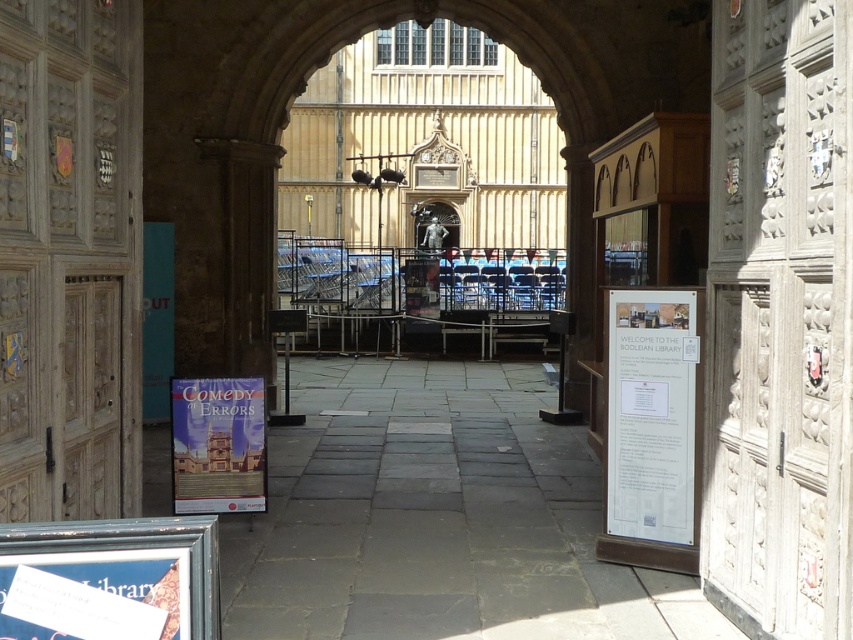
Does white paper at right have a lesser height compared to matte paper poster at center?

Incorrect, white paper at right's height does not fall short of matte paper poster at center's.

Which of these two, white paper at right or matte paper poster at center, stands shorter?

Standing shorter between the two is matte paper poster at center.

Which is in front, point (643, 330) or point (225, 481)?

Point (643, 330) is more forward.

I want to click on white paper at right, so click(x=650, y=413).

Does matte paper poster at lower left have a smaller size compared to matte paper poster at center?

Correct, matte paper poster at lower left occupies less space than matte paper poster at center.

Who is more distant from viewer, (28, 577) or (216, 513)?

Point (216, 513)

Describe the element at coordinates (96, 595) in the screenshot. I see `matte paper poster at lower left` at that location.

This screenshot has width=853, height=640. I want to click on matte paper poster at lower left, so click(96, 595).

How far apart are white paper at right and matte paper poster at lower left?

The distance of white paper at right from matte paper poster at lower left is 3.97 meters.

Describe the element at coordinates (650, 413) in the screenshot. I see `white paper at right` at that location.

Locate an element on the screen. Image resolution: width=853 pixels, height=640 pixels. white paper at right is located at coordinates (x=650, y=413).